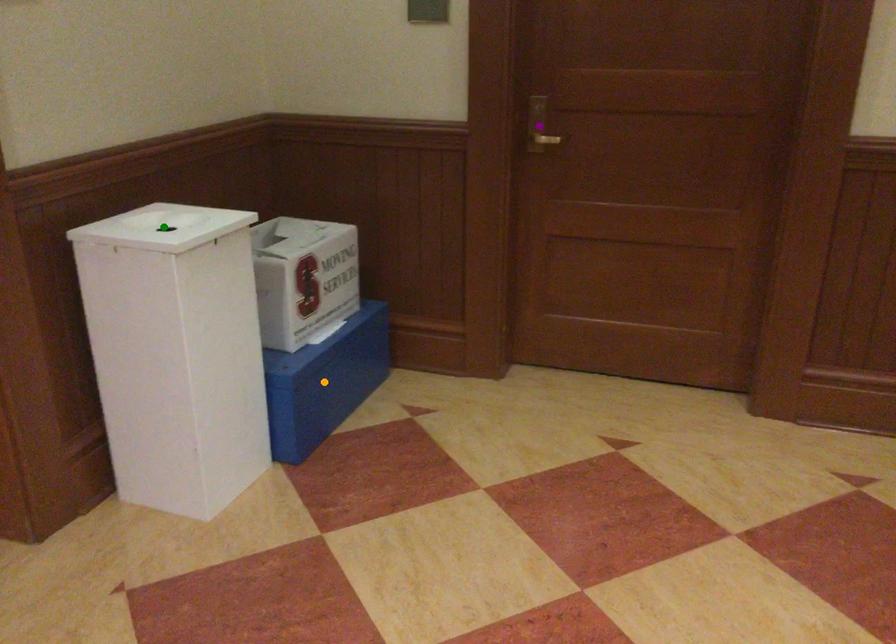
Order these from nearest to farthest:
- orange point
- purple point
- green point

green point → purple point → orange point